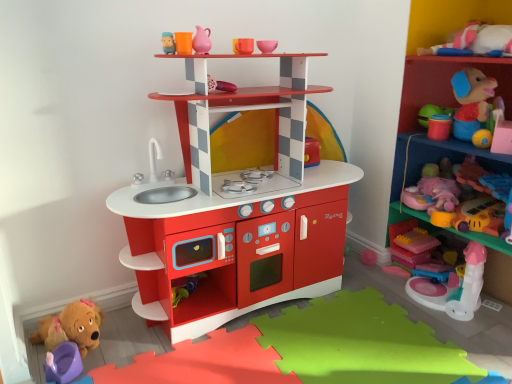
The width and height of the screenshot is (512, 384). I want to click on vacant space behind purple plastic potty at lower left, acting as the 2th toy starting from the left, so click(104, 337).